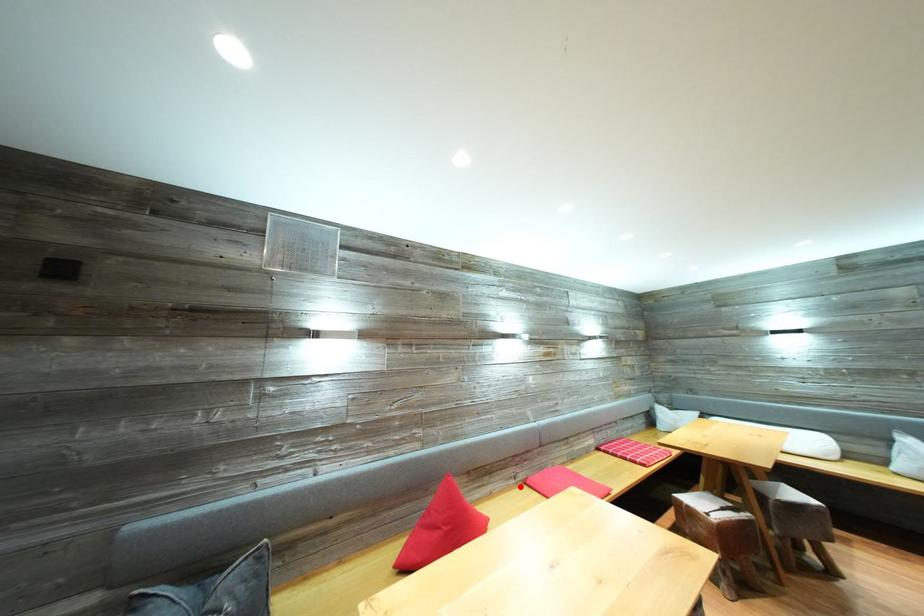
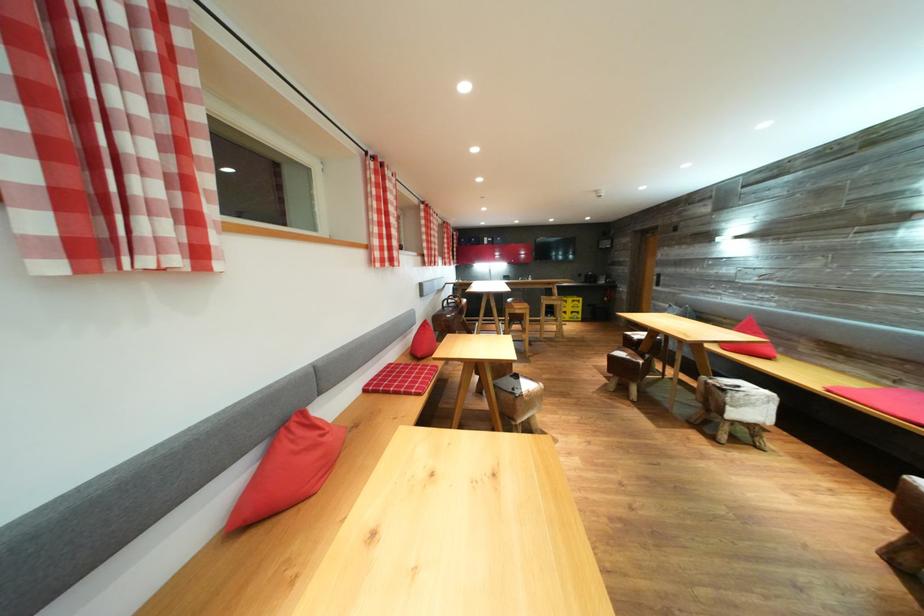
The point at the highlighted location is marked in the first image. Where is the corresponding point in the second image?

(895, 389)